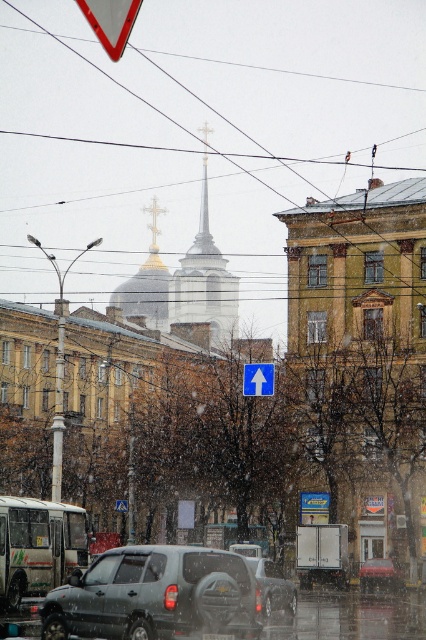
You are a delivery driver navigating a one way street in the snowy scene. You see the smooth white spire at center and the metallic triangular sign at center. According to the traffic signs, which direction should you drive to stay on the one way street?

The smooth white spire at center is to the right of the metallic triangular sign at center, so you should drive towards the direction of the smooth white spire at center to stay on the one way street indicated by the blue traffic sign with a white upward arrow.

You are a pedestrian standing at the crosswalk and want to cross the street to reach the white matte bus at center. The metallic triangular sign at center indicates a one way street. Which direction should you walk to reach the bus first?

The white matte bus at center is to the right of the metallic triangular sign at center, so you should walk to the right side of the sign to reach the white matte bus at center first.